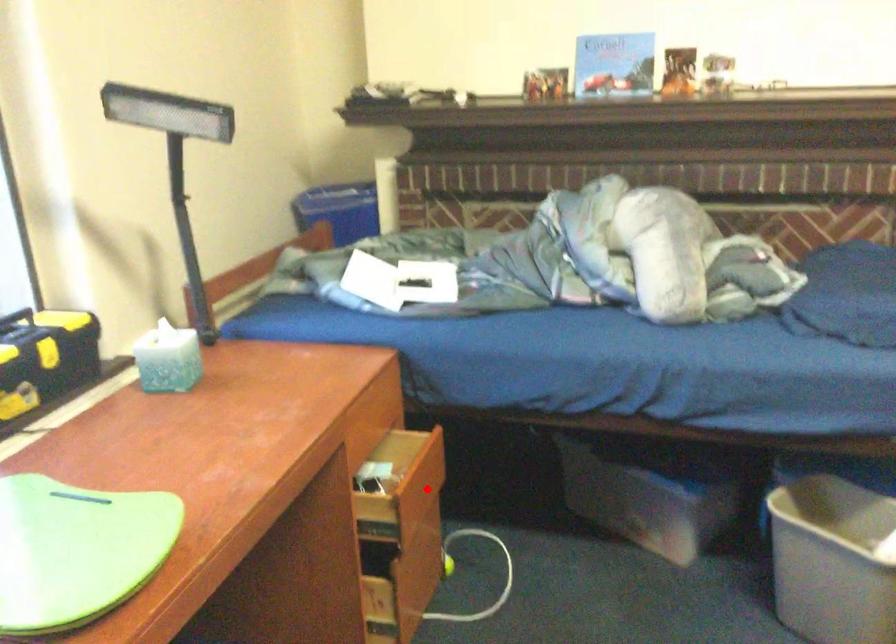
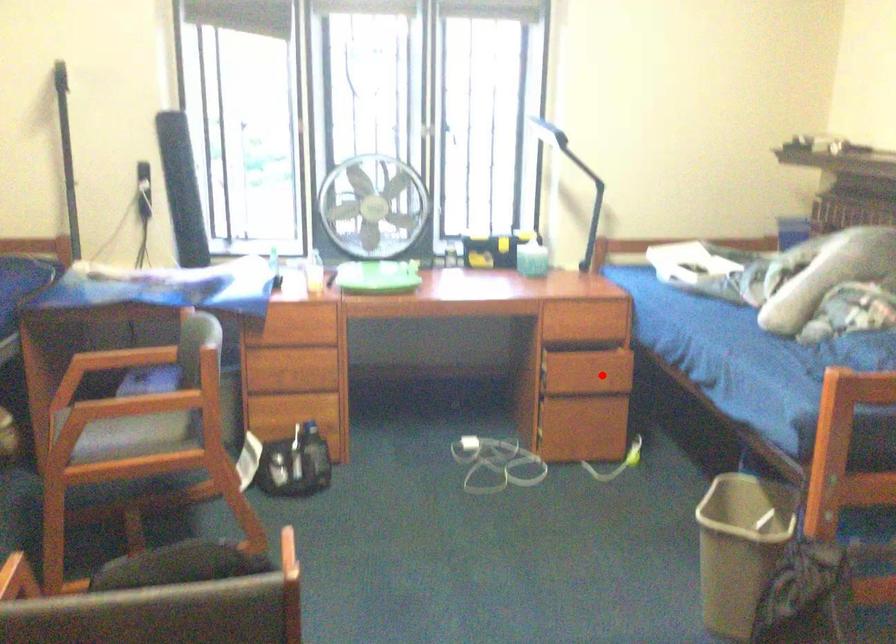
I am providing you with two images of the same scene from different viewpoints. A red point is marked on the first image and another point is marked on the second image. Are the points marked in image1 and image2 representing the same 3D position?

Yes